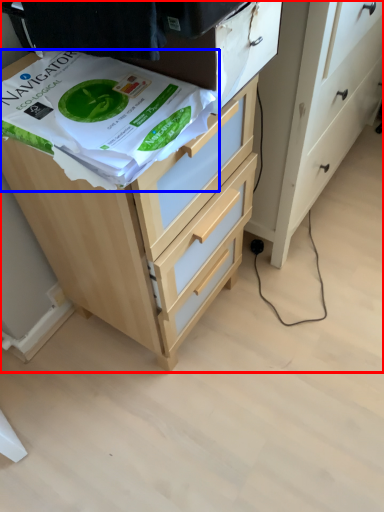
Question: Among these objects, which one is nearest to the camera, chest of drawers (highlighted by a red box) or wrapping paper (highlighted by a blue box)?

Choices:
 (A) chest of drawers
 (B) wrapping paper

Answer: (B)